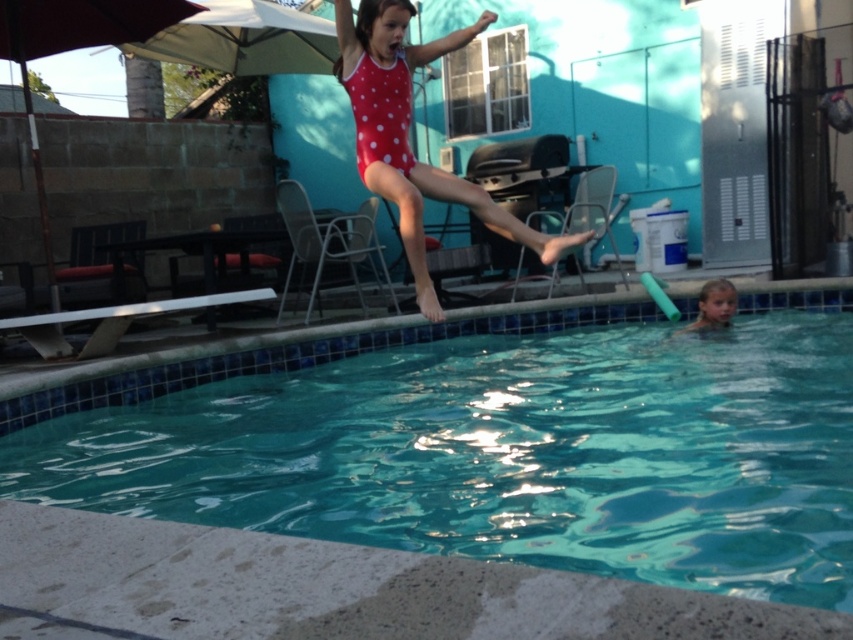
Based on the photo, you are a photographer trying to capture the entire scene of the smooth skin child at lower right and the teal glossy water at center. Which object should you focus on first to ensure both are in frame?

The teal glossy water at center is larger in size than the smooth skin child at lower right, so you should focus on the teal glossy water at center first to ensure both are in frame.

You are a photographer setting up a shot of the backyard pool scene. You want to position your camera so that the red fabric umbrella at upper left and the smooth skin child at lower right are both in frame. Based on their positions, which object should be placed on the left side of your camera frame?

The red fabric umbrella at upper left should be placed on the left side of your camera frame because it is to the left of the smooth skin child at lower right.

Consider the image. You are a photographer trying to capture the exact point where the girl will land in the pool. The coordinates given are point (407, 134) on the red polka dot swimsuit at upper center. Can you determine if this point will be submerged underwater when she lands?

The point (407, 134) on the red polka dot swimsuit at upper center will be submerged underwater when she lands because it is located on her swimsuit, which is part of her body entering the water.